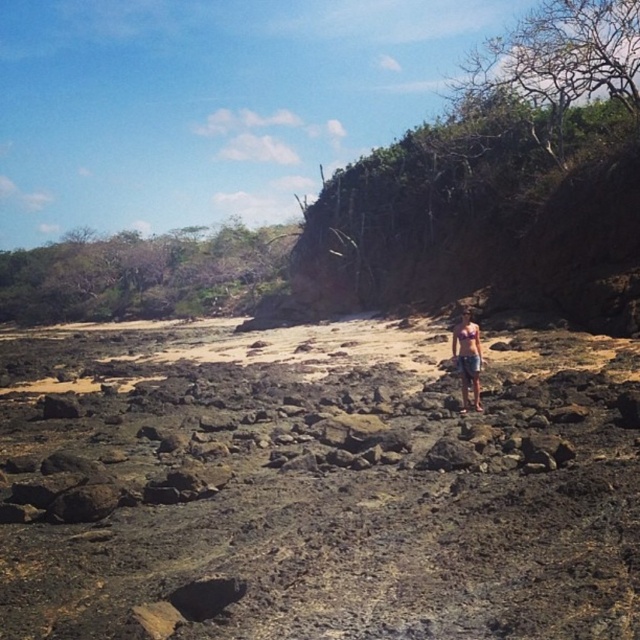
In the scene shown: You are a photographer trying to capture the matte pink bikini top at center while ensuring the dark brown lava rocks at center are visible in the background. Given their size difference, which object will appear bigger in the photo?

The dark brown lava rocks at center will appear bigger in the photo since they are larger in size compared to the matte pink bikini top at center.

You are a drone operator who needs to capture a photo of the dark brown lava rocks at center. The drone is currently hovering at point (x=316, y=484). Is the drone already positioned over the dark brown lava rocks at center?

Yes, the dark brown lava rocks at center is represented by point (x=316, y=484), so the drone is already positioned over the dark brown lava rocks at center.